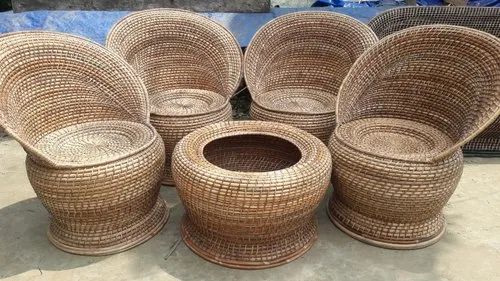
At what (x,y) coordinates should I click in order to perform the action: click on open basket. Please return your answer as a coordinate pair (x, y). The height and width of the screenshot is (281, 500). Looking at the image, I should click on (248, 163).